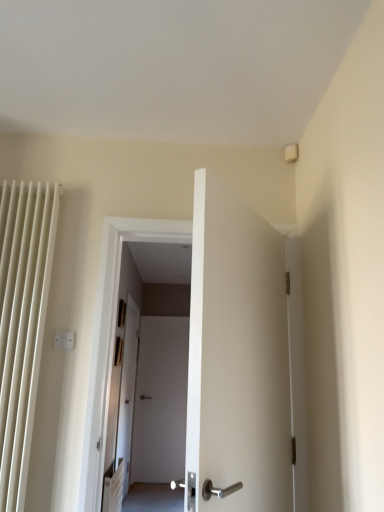
Question: Is satin silver door handle at center in front of or behind white plastic electric outlet at upper center in the image?

Choices:
 (A) front
 (B) behind

Answer: (B)

Question: Would you say satin silver door handle at center is to the left or to the right of white plastic electric outlet at upper center in the picture?

Choices:
 (A) right
 (B) left

Answer: (A)

Question: From the image's perspective, relative to white plastic electric outlet at upper center, is satin silver door handle at center above or below?

Choices:
 (A) above
 (B) below

Answer: (B)

Question: Looking at the image, does white plastic electric outlet at upper center seem bigger or smaller compared to satin silver door handle at center?

Choices:
 (A) small
 (B) big

Answer: (A)

Question: Would you say white plastic electric outlet at upper center is inside or outside satin silver door handle at center?

Choices:
 (A) outside
 (B) inside

Answer: (A)

Question: From a real-world perspective, relative to satin silver door handle at center, is white plastic electric outlet at upper center vertically above or below?

Choices:
 (A) below
 (B) above

Answer: (B)

Question: In the image, is white plastic electric outlet at upper center positioned in front of or behind satin silver door handle at center?

Choices:
 (A) behind
 (B) front

Answer: (B)